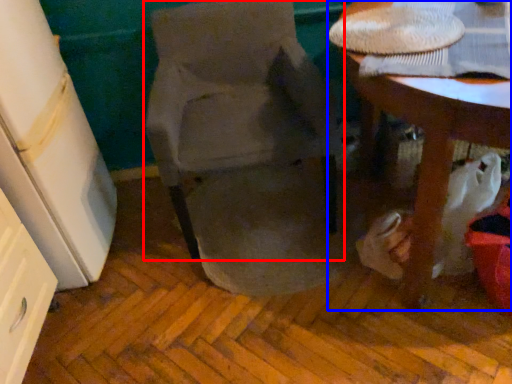
Question: Among these objects, which one is nearest to the camera, chair (highlighted by a red box) or table (highlighted by a blue box)?

Choices:
 (A) chair
 (B) table

Answer: (B)